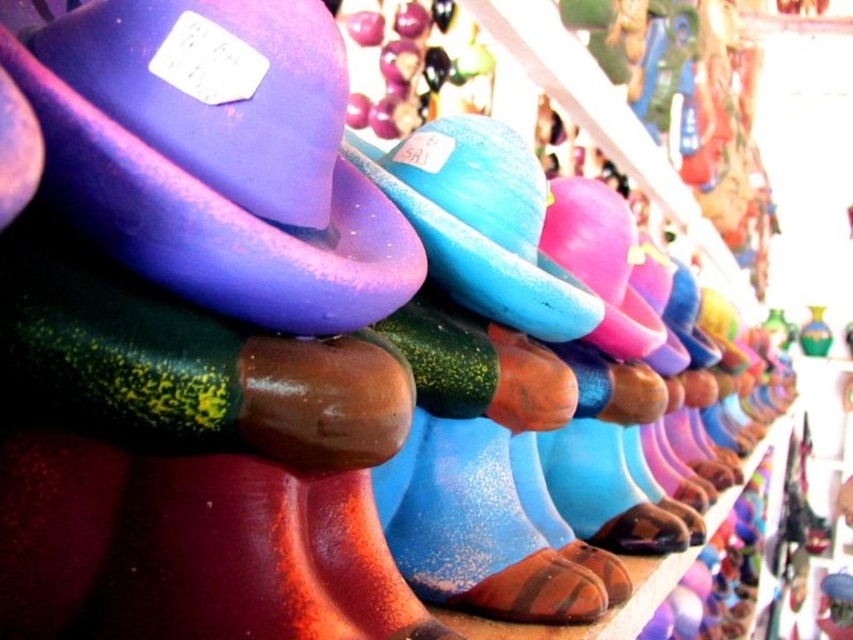
You are an interior designer arranging a shelf with the purple matte hat at upper left and the satin blue hat at center. Which hat should you place in a spot where size matters, like a smaller shelf compartment?

The purple matte hat at upper left is smaller than the satin blue hat at center, so it should be placed in the smaller shelf compartment.

You are an art curator planning to install a new light fixture in the center of the display. The light fixture will be placed at coordinates point 0.25, 0.25. Will the purple matte hat at upper left be directly under the new light fixture?

The purple matte hat at upper left is positioned at point (216, 156), which is very close to the light fixture at (212, 160). The coordinates are nearly the same, so yes, the purple matte hat at upper left will be directly under the new light fixture.

You are a collector who wants to place a new figurine on the shelf. The shelf is 16 inches wide. The purple matte hat at upper left is currently on the shelf. Can you fit another figurine next to it without exceeding the shelf width?

The purple matte hat at upper left and viewer are 14.81 inches apart. Since the shelf is 16 inches wide, there is 1.19 inches of space remaining. This is likely insufficient to fit another figurine next to the purple matte hat at upper left.